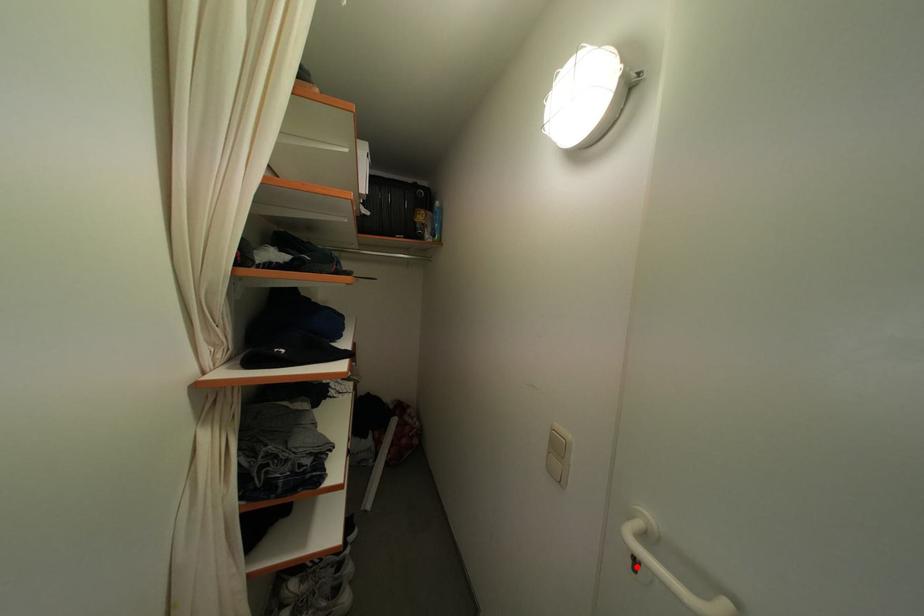
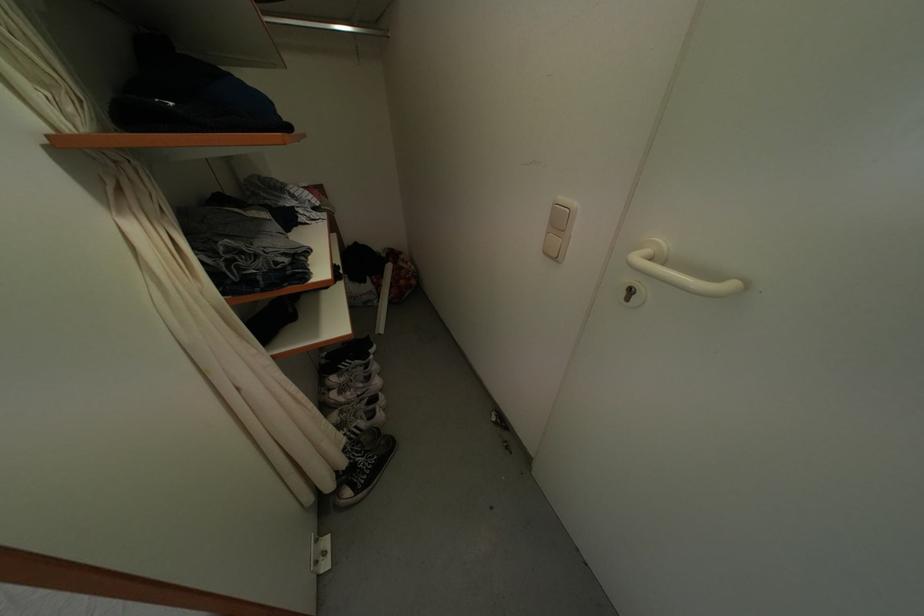
The point at the highlighted location is marked in the first image. Where is the corresponding point in the second image?

(630, 299)